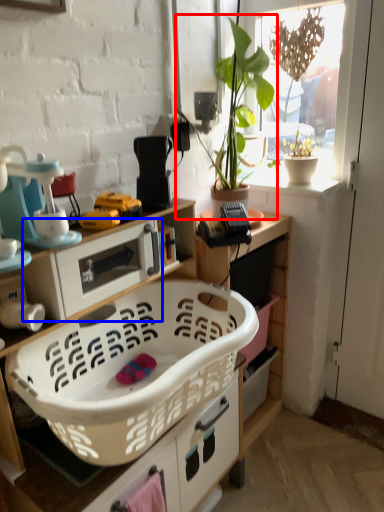
Question: Which object appears farthest to the camera in this image, houseplant (highlighted by a red box) or appliance (highlighted by a blue box)?

Choices:
 (A) houseplant
 (B) appliance

Answer: (A)